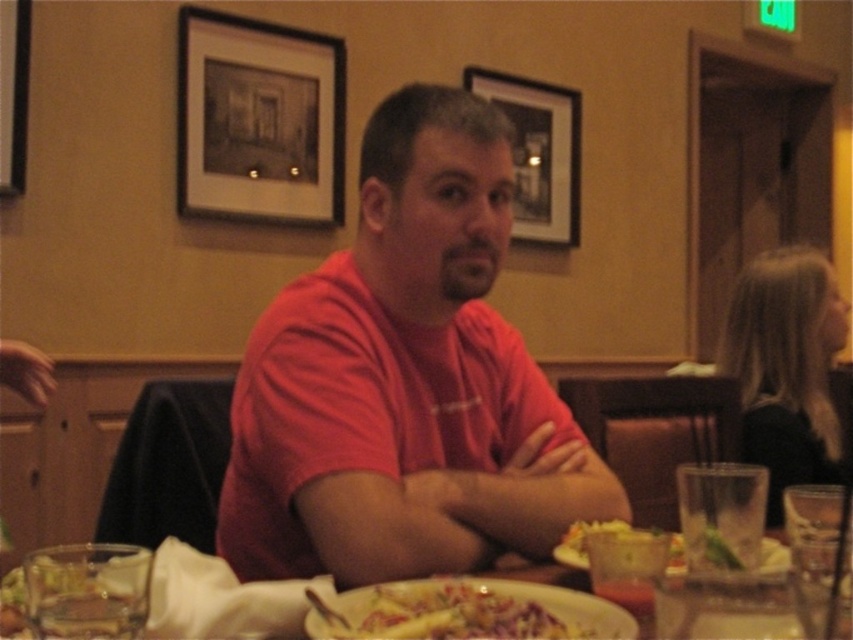
Question: Can you confirm if matte black picture frame at upper center is smaller than clear glass at lower left?

Choices:
 (A) yes
 (B) no

Answer: (B)

Question: Estimate the real-world distances between objects in this image. Which object is farther from the transparent plastic cup at lower right?

Choices:
 (A) translucent glass bowl at lower center
 (B) black matte picture frame at upper center
 (C) translucent glass at center
 (D) clear glass at lower left

Answer: (B)

Question: Can you confirm if clear glass at lower left is positioned to the left of transparent plastic cup at lower right?

Choices:
 (A) yes
 (B) no

Answer: (A)

Question: Can you confirm if black matte picture frame at upper center is bigger than translucent glass bowl at lower center?

Choices:
 (A) yes
 (B) no

Answer: (A)

Question: Which object is farther from the camera taking this photo?

Choices:
 (A) translucent glass bowl at lower center
 (B) translucent glass at center

Answer: (A)

Question: Which object appears farthest from the camera in this image?

Choices:
 (A) clear glass at lower left
 (B) black matte picture frame at upper center
 (C) matte red shirt at center
 (D) translucent glass at center

Answer: (B)